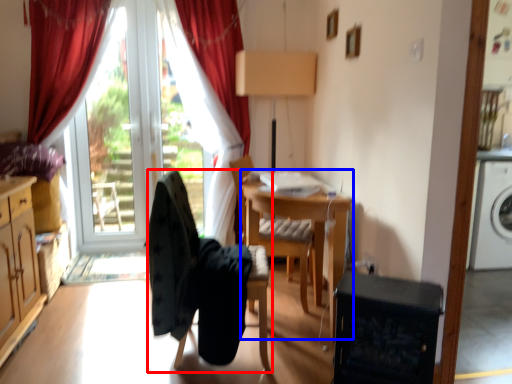
Question: Which object is further to the camera taking this photo, chair (highlighted by a red box) or computer desk (highlighted by a blue box)?

Choices:
 (A) chair
 (B) computer desk

Answer: (B)